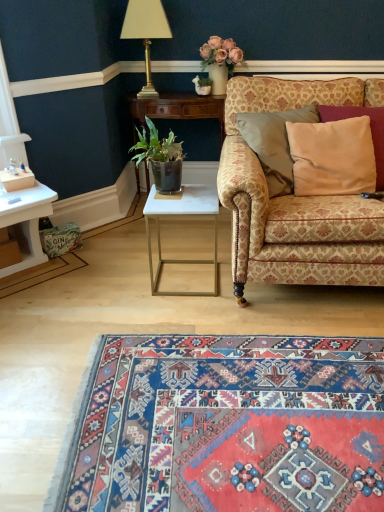
What are the coordinates of `vacant location below white marble table at center, the 1th table viewed from the front (from a real-world perspective)` in the screenshot? It's located at (184, 280).